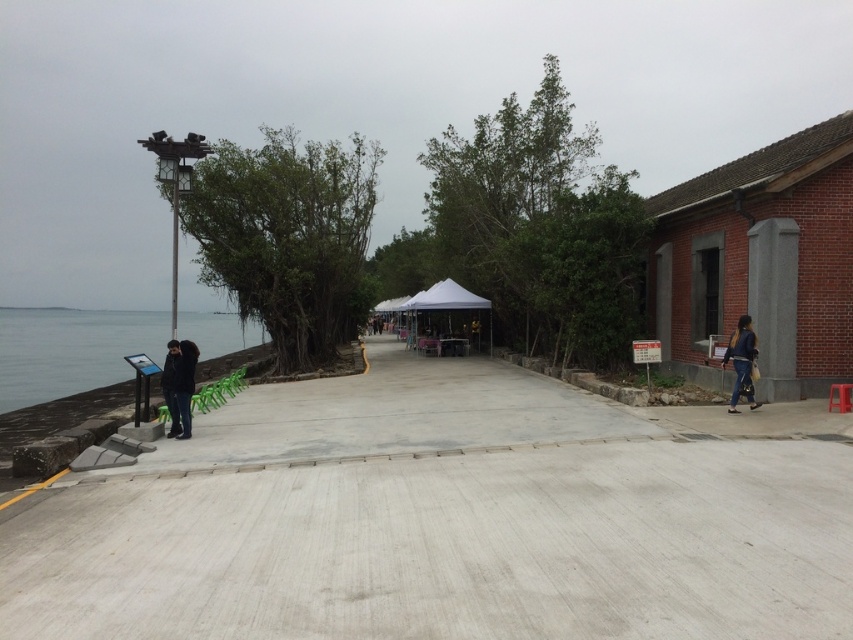
You are a maintenance worker checking the elevation of the gray concrete path at center and the dark blue jeans at right. Which one is lower in height?

The gray concrete path at center has a lesser height compared to the dark blue jeans at right, so the gray concrete path at center is lower in height.

You are a tourist holding a map and standing on the gray concrete path at center. You want to sit down to read the map. Are the dark blue jeans at right located closer to you or farther away than the path you are standing on?

The gray concrete path at center is closer to the viewer than the dark blue jeans at right, so the dark blue jeans at right are farther away from you than the path you are standing on.

You are a tourist standing on the paved pathway in the waterfront area. You see a dark blue jacket at left and a dark blue jeans at right. Which item is closer to the display board mounted on the stand?

The dark blue jacket at left is closer to the display board mounted on the stand because it is positioned to the left of the dark blue jeans at right, and the display board is also on the left side of the pathway.